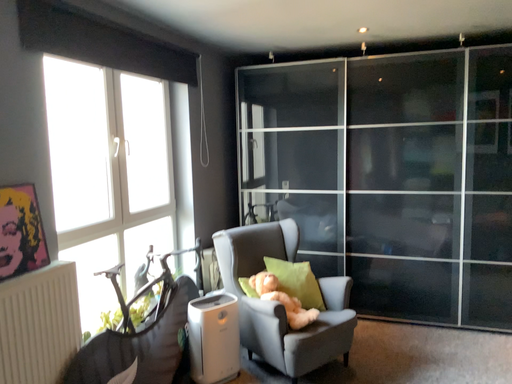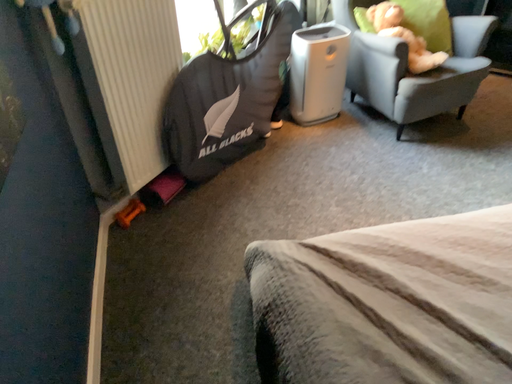
Question: How did the camera likely rotate when shooting the video?

Choices:
 (A) rotated right
 (B) rotated left

Answer: (B)